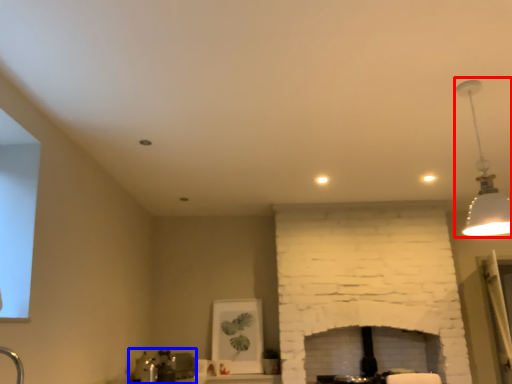
Question: Which object is further to the camera taking this photo, lamp (highlighted by a red box) or sink (highlighted by a blue box)?

Choices:
 (A) lamp
 (B) sink

Answer: (B)